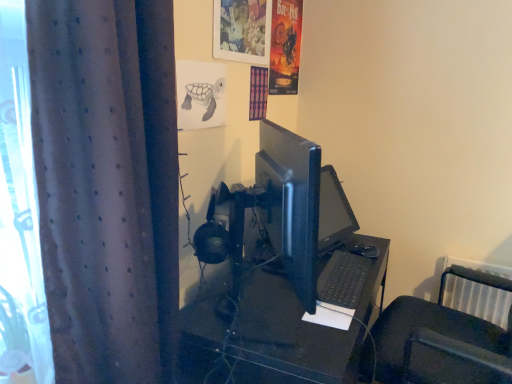
Question: From the image's perspective, would you say gray pencil drawing of turtle at upper center, positioned as the 1th poster page in left-to-right order, is positioned over vibrant paper poster at upper right, which appears as the 2th poster page when viewed from the front?

Choices:
 (A) yes
 (B) no

Answer: (B)

Question: Does gray pencil drawing of turtle at upper center, positioned as the 1th poster page in left-to-right order, have a lesser width compared to vibrant paper poster at upper right, which ranks as the first poster page in right-to-left order?

Choices:
 (A) no
 (B) yes

Answer: (B)

Question: From a real-world perspective, is gray pencil drawing of turtle at upper center, placed as the 2th poster page when sorted from top to bottom, located higher than vibrant paper poster at upper right, which ranks as the first poster page in right-to-left order?

Choices:
 (A) no
 (B) yes

Answer: (A)

Question: Is gray pencil drawing of turtle at upper center, which appears as the 1th poster page when viewed from the front, next to vibrant paper poster at upper right, the 1th poster page positioned from the top, and touching it?

Choices:
 (A) no
 (B) yes

Answer: (A)

Question: Can you confirm if gray pencil drawing of turtle at upper center, placed as the 2th poster page when sorted from top to bottom, is smaller than vibrant paper poster at upper right, which appears as the 2th poster page when viewed from the front?

Choices:
 (A) yes
 (B) no

Answer: (A)

Question: Does gray pencil drawing of turtle at upper center, which is the second poster page from back to front, appear on the left side of vibrant paper poster at upper right, which appears as the 2th poster page when viewed from the front?

Choices:
 (A) no
 (B) yes

Answer: (B)

Question: Is dark grey textured curtain at left positioned in front of black plastic desk at center?

Choices:
 (A) no
 (B) yes

Answer: (B)

Question: Are dark grey textured curtain at left and black plastic desk at center making contact?

Choices:
 (A) no
 (B) yes

Answer: (A)

Question: Does dark grey textured curtain at left come behind black plastic desk at center?

Choices:
 (A) no
 (B) yes

Answer: (A)

Question: Is dark grey textured curtain at left positioned with its back to black plastic desk at center?

Choices:
 (A) yes
 (B) no

Answer: (B)

Question: Is dark grey textured curtain at left oriented towards black plastic desk at center?

Choices:
 (A) yes
 (B) no

Answer: (B)

Question: From a real-world perspective, is dark grey textured curtain at left physically above black plastic desk at center?

Choices:
 (A) no
 (B) yes

Answer: (B)

Question: Is matte plastic picture frame at upper center closer to camera compared to black plastic keyboard at lower center?

Choices:
 (A) yes
 (B) no

Answer: (B)